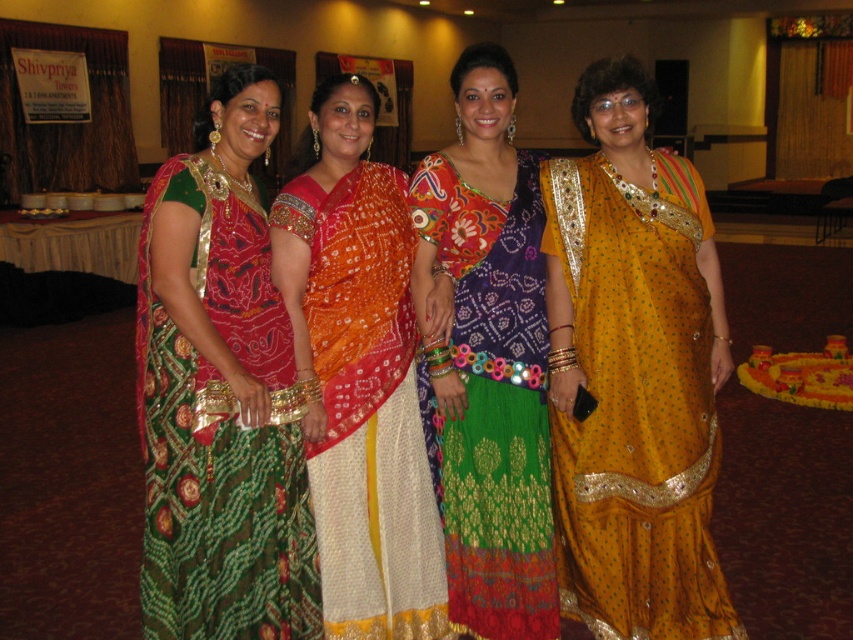
Question: Which point is closer to the camera taking this photo?

Choices:
 (A) (682, 516)
 (B) (451, 310)
 (C) (322, 202)
 (D) (306, 492)

Answer: (D)

Question: Is orange bandhani sari at center positioned before multicolored embroidered sari at center?

Choices:
 (A) yes
 (B) no

Answer: (A)

Question: Estimate the real-world distances between objects in this image. Which object is closer to the orange bandhani sari at center?

Choices:
 (A) multicolored embroidered sari at center
 (B) golden silk saree at center
 (C) green brocade saree at center

Answer: (A)

Question: Does golden silk saree at center have a smaller size compared to green brocade saree at center?

Choices:
 (A) yes
 (B) no

Answer: (B)

Question: Which of these objects is positioned farthest from the orange bandhani sari at center?

Choices:
 (A) multicolored embroidered sari at center
 (B) golden silk saree at center
 (C) green brocade saree at center

Answer: (B)

Question: Does orange bandhani sari at center appear over multicolored embroidered sari at center?

Choices:
 (A) no
 (B) yes

Answer: (A)